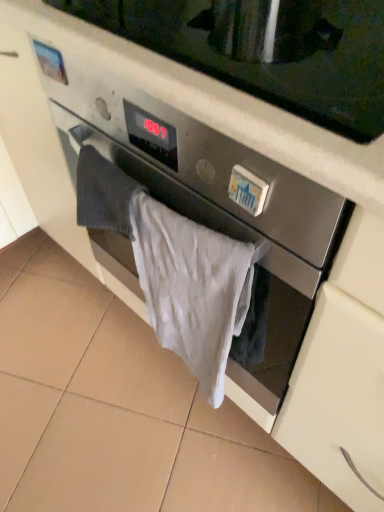
Question: Should I look upward or downward to see white cotton towel at center?

Choices:
 (A) down
 (B) up

Answer: (A)

Question: From a real-world perspective, is satin silver microwave at center over white cotton towel at center?

Choices:
 (A) yes
 (B) no

Answer: (A)

Question: Would you say satin silver microwave at center contains white cotton towel at center?

Choices:
 (A) yes
 (B) no

Answer: (B)

Question: Is satin silver microwave at center shorter than white cotton towel at center?

Choices:
 (A) no
 (B) yes

Answer: (B)

Question: Considering the relative positions of satin silver microwave at center and white cotton towel at center in the image provided, is satin silver microwave at center behind white cotton towel at center?

Choices:
 (A) yes
 (B) no

Answer: (B)

Question: Considering the relative sizes of satin silver microwave at center and white cotton towel at center in the image provided, is satin silver microwave at center bigger than white cotton towel at center?

Choices:
 (A) no
 (B) yes

Answer: (B)

Question: Is there a large distance between satin silver microwave at center and white cotton towel at center?

Choices:
 (A) no
 (B) yes

Answer: (A)

Question: Is white cotton towel at center positioned with its back to satin silver microwave at center?

Choices:
 (A) yes
 (B) no

Answer: (A)

Question: From the image's perspective, is white cotton towel at center beneath satin silver microwave at center?

Choices:
 (A) yes
 (B) no

Answer: (A)

Question: Does white cotton towel at center have a smaller size compared to satin silver microwave at center?

Choices:
 (A) yes
 (B) no

Answer: (A)

Question: Considering the relative sizes of white cotton towel at center and satin silver microwave at center in the image provided, is white cotton towel at center taller than satin silver microwave at center?

Choices:
 (A) yes
 (B) no

Answer: (A)

Question: Is there a large distance between white cotton towel at center and satin silver microwave at center?

Choices:
 (A) no
 (B) yes

Answer: (A)

Question: Is white cotton towel at center aimed at satin silver microwave at center?

Choices:
 (A) yes
 (B) no

Answer: (B)

Question: From a real-world perspective, is white cotton towel at center positioned above or below satin silver microwave at center?

Choices:
 (A) above
 (B) below

Answer: (B)